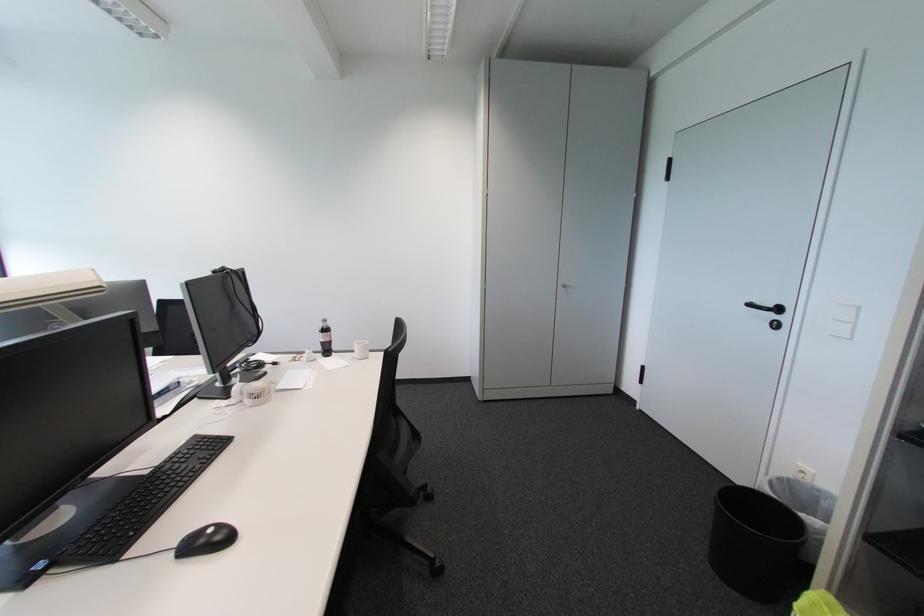
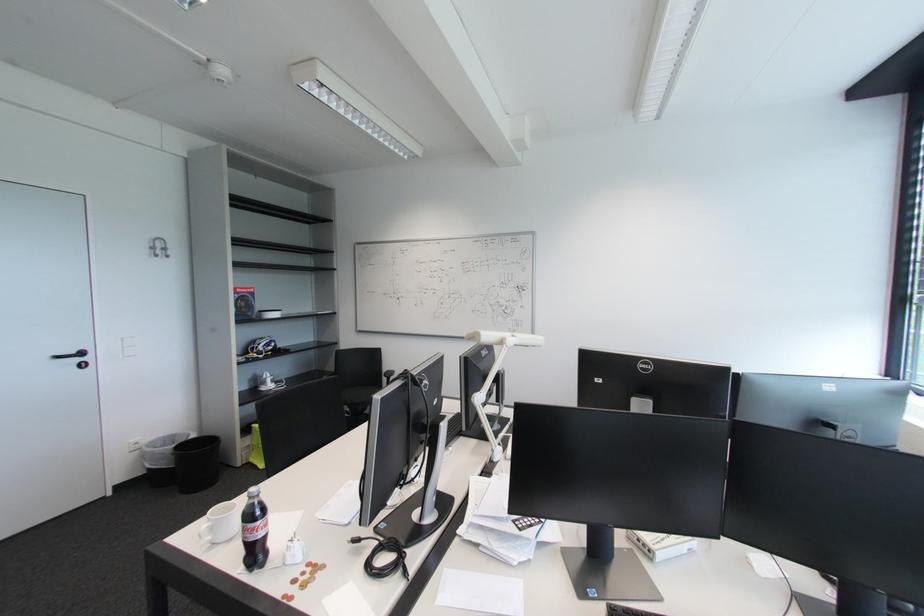
Find the pixel in the second image that matches point 777,317 in the first image.

(83, 361)